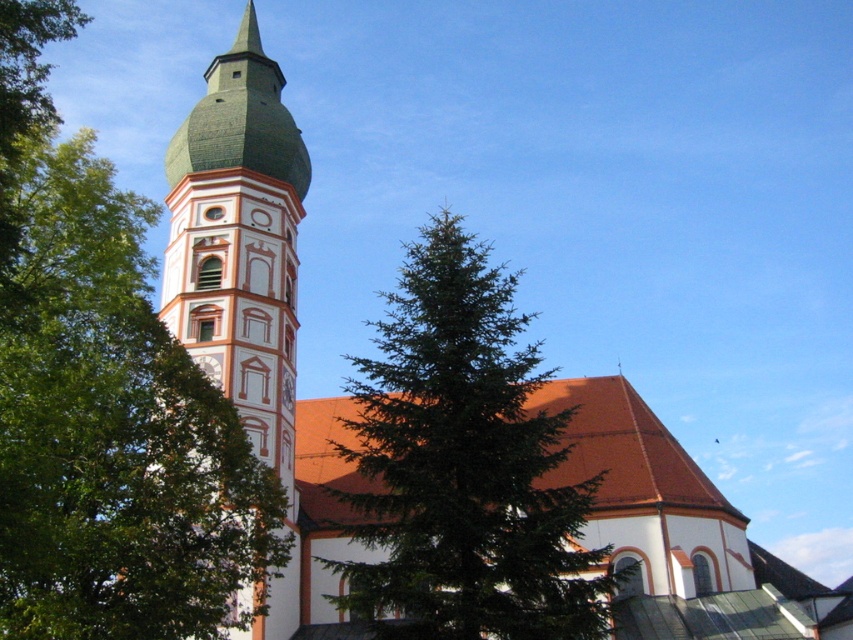
You are standing at the entrance of the church and want to take a photo of the bell tower. There is a green textured pine tree at left in the foreground. To avoid the tree blocking the view, should you move to your left or right?

The green textured pine tree at left is located at point [109,426], so you should move to your right to avoid the tree blocking the view of the bell tower.

You are standing in front of the church and want to take a photo that includes both the green textured pine tree at left and the green textured pine tree at center. Which tree should you move closer to if you want the tree to occupy more space in your photo?

To have the tree occupy more space in the photo, you should move closer to the green textured pine tree at left because it is narrower than the green textured pine tree at center, so moving closer would make it appear larger in the frame.

You are standing in front of the church and notice the green textured pine tree at left and the green matte steeple at upper left. Which object is closer to the viewer?

The green textured pine tree at left is closer to the viewer because it is positioned under the green matte steeple at upper left, indicating it is in front of the steeple.